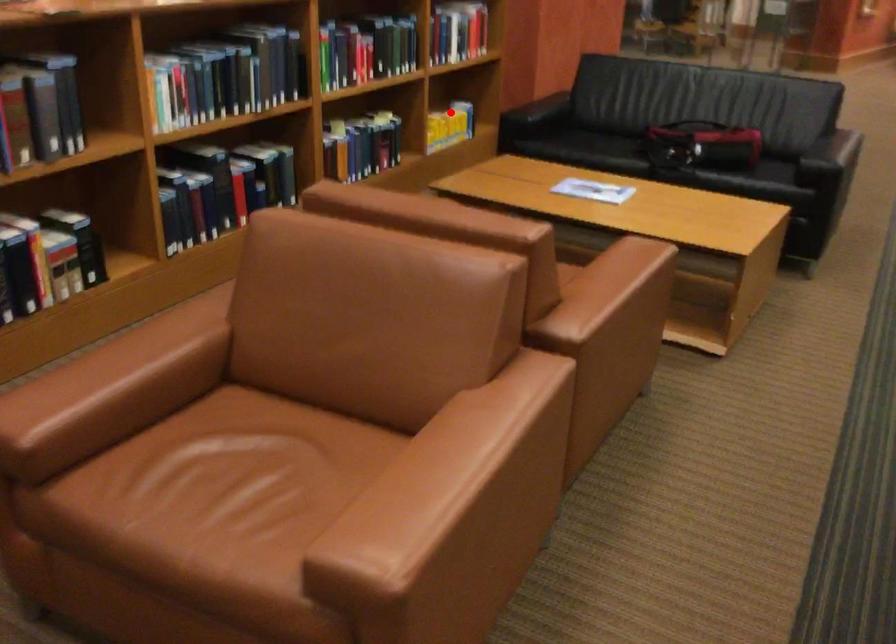
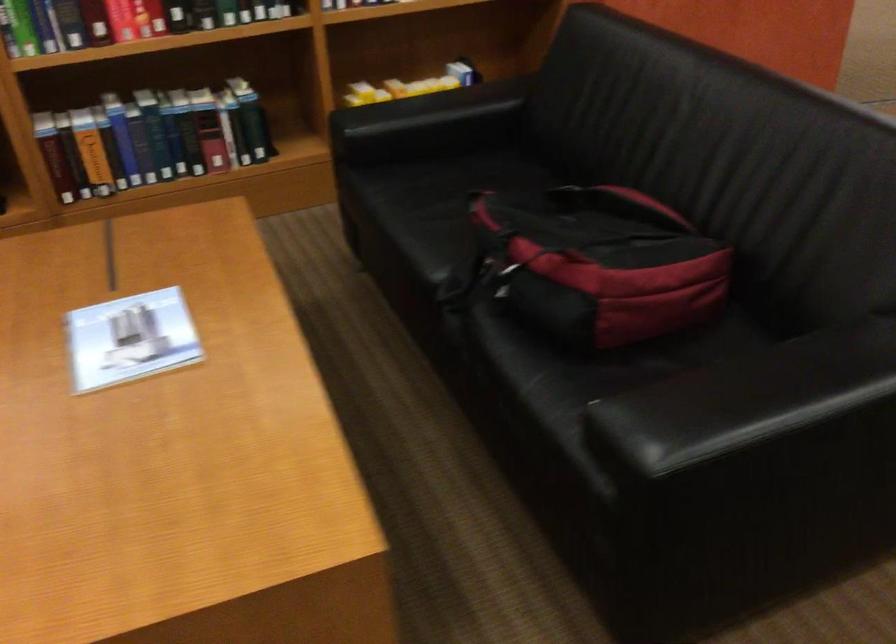
Question: I am providing you with two images of the same scene from different viewpoints. In image1, a red point is highlighted. Considering the same 3D point in image2, which of the following is correct?

Choices:
 (A) It is closer
 (B) It is farther

Answer: (A)